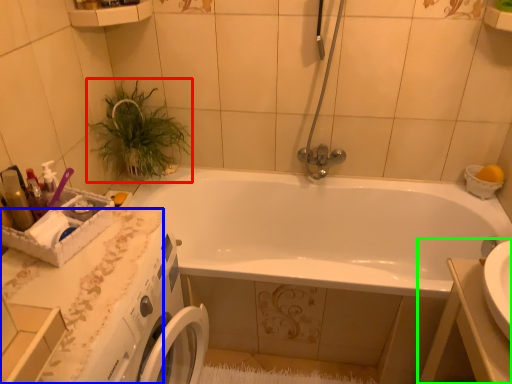
Question: Based on their relative distances, which object is farther from plant (highlighted by a red box)? Choose from counter top (highlighted by a blue box) and sink (highlighted by a green box).

Choices:
 (A) counter top
 (B) sink

Answer: (B)